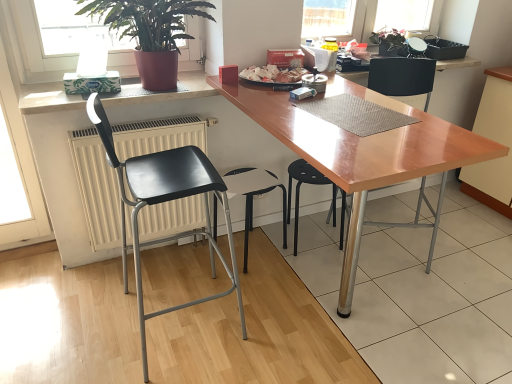
Identify the location of free space underneath wooden table at center (from a real-world perspective). (334, 299).